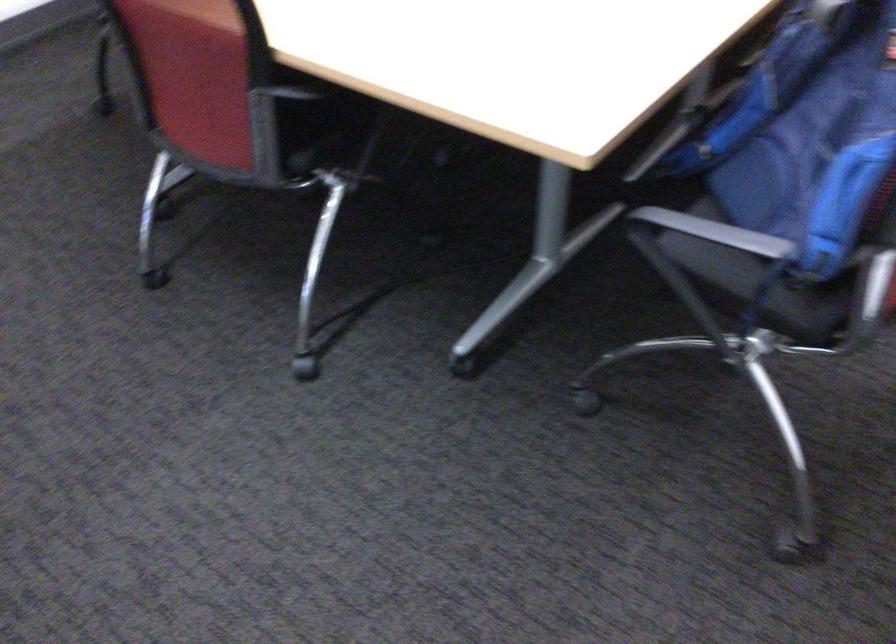
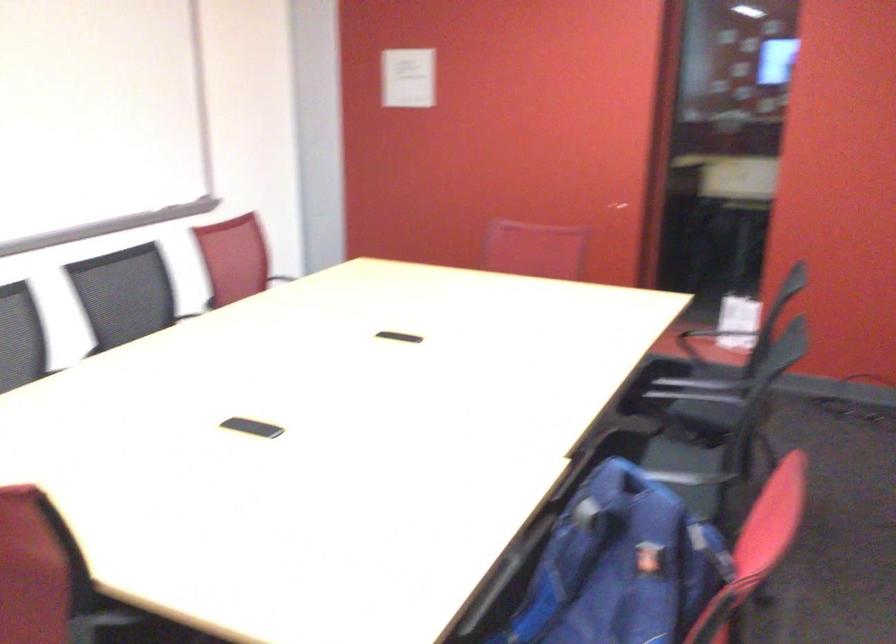
Question: The images are taken continuously from a first-person perspective. In which direction is your viewpoint rotating?

Choices:
 (A) Left
 (B) Right
 (C) Up
 (D) Down

Answer: (C)